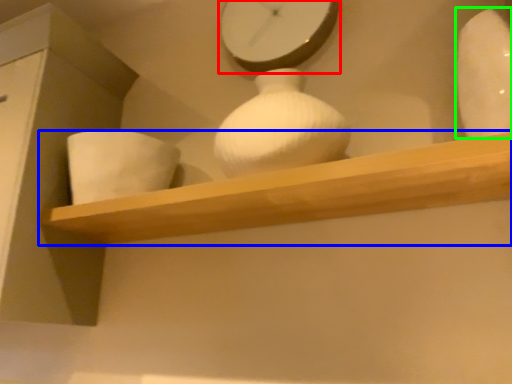
Question: Which object is positioned closest to clock (highlighted by a red box)? Select from shelf (highlighted by a blue box) and vase (highlighted by a green box).

Choices:
 (A) shelf
 (B) vase

Answer: (B)